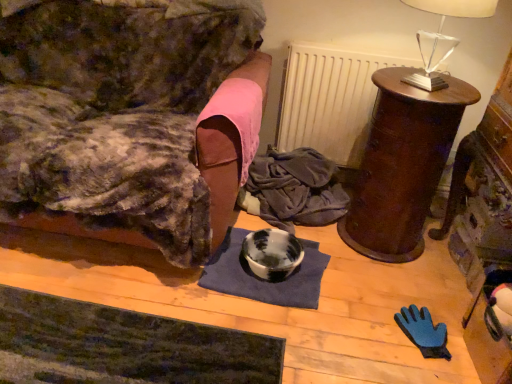
Question: Could you tell me if blue fabric mat at center is turned towards velvet couch at left, placed as the 2th furniture when sorted from right to left?

Choices:
 (A) yes
 (B) no

Answer: (B)

Question: Does blue fabric mat at center appear on the left side of velvet couch at left, the 1th furniture when ordered from left to right?

Choices:
 (A) yes
 (B) no

Answer: (B)

Question: From a real-world perspective, is blue fabric mat at center beneath velvet couch at left, placed as the 2th furniture when sorted from right to left?

Choices:
 (A) yes
 (B) no

Answer: (A)

Question: Can you confirm if blue fabric mat at center is thinner than velvet couch at left, placed as the 2th furniture when sorted from right to left?

Choices:
 (A) no
 (B) yes

Answer: (B)

Question: Is velvet couch at left, placed as the 2th furniture when sorted from right to left, a part of blue fabric mat at center?

Choices:
 (A) no
 (B) yes

Answer: (A)

Question: From a real-world perspective, relative to clear glass table lamp at upper right, is dark green textured yoga mat at lower left vertically above or below?

Choices:
 (A) below
 (B) above

Answer: (A)

Question: Looking at their shapes, would you say dark green textured yoga mat at lower left is wider or thinner than clear glass table lamp at upper right?

Choices:
 (A) wide
 (B) thin

Answer: (A)

Question: In terms of size, does dark green textured yoga mat at lower left appear bigger or smaller than clear glass table lamp at upper right?

Choices:
 (A) big
 (B) small

Answer: (A)

Question: Visually, is dark green textured yoga mat at lower left positioned to the left or to the right of clear glass table lamp at upper right?

Choices:
 (A) left
 (B) right

Answer: (A)

Question: Considering the positions of point (260, 369) and point (317, 140), is point (260, 369) closer or farther from the camera than point (317, 140)?

Choices:
 (A) farther
 (B) closer

Answer: (B)

Question: Is dark green textured yoga mat at lower left inside the boundaries of white matte radiator at upper center, or outside?

Choices:
 (A) inside
 (B) outside

Answer: (B)

Question: Looking at their shapes, would you say dark green textured yoga mat at lower left is wider or thinner than white matte radiator at upper center?

Choices:
 (A) thin
 (B) wide

Answer: (B)

Question: Looking at the image, does dark green textured yoga mat at lower left seem bigger or smaller compared to white matte radiator at upper center?

Choices:
 (A) big
 (B) small

Answer: (B)

Question: In the image, is blue fabric mat at center on the left side or the right side of clear glass table lamp at upper right?

Choices:
 (A) right
 (B) left

Answer: (B)

Question: From the image's perspective, relative to clear glass table lamp at upper right, is blue fabric mat at center above or below?

Choices:
 (A) above
 (B) below

Answer: (B)